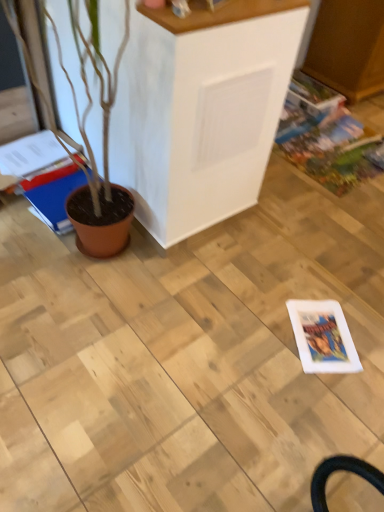
Question: From a real-world perspective, is blue glossy magazine at left, the 2th magazine from the right, physically above multicolored glossy comic book at right?

Choices:
 (A) yes
 (B) no

Answer: (A)

Question: Does blue glossy magazine at left, positioned as the first magazine in left-to-right order, lie behind multicolored glossy comic book at right?

Choices:
 (A) no
 (B) yes

Answer: (A)

Question: Is blue glossy magazine at left, positioned as the first magazine in left-to-right order, thinner than multicolored glossy comic book at right?

Choices:
 (A) yes
 (B) no

Answer: (A)

Question: Can you confirm if blue glossy magazine at left, the 2th magazine from the right, is wider than multicolored glossy comic book at right?

Choices:
 (A) yes
 (B) no

Answer: (B)

Question: Does blue glossy magazine at left, positioned as the first magazine in left-to-right order, contain multicolored glossy comic book at right?

Choices:
 (A) yes
 (B) no

Answer: (B)

Question: Does blue glossy magazine at left, positioned as the first magazine in left-to-right order, come in front of multicolored glossy comic book at right?

Choices:
 (A) yes
 (B) no

Answer: (A)

Question: Can you confirm if matte brown magazine at left, which is counted as the 1th magazine, starting from the right, is shorter than blue glossy magazine at left, the 2th magazine from the right?

Choices:
 (A) yes
 (B) no

Answer: (A)

Question: Considering the relative sizes of matte brown magazine at left, which is the 2th magazine from left to right, and blue glossy magazine at left, the 2th magazine from the right, in the image provided, is matte brown magazine at left, which is the 2th magazine from left to right, wider than blue glossy magazine at left, the 2th magazine from the right,?

Choices:
 (A) no
 (B) yes

Answer: (A)

Question: Is blue glossy magazine at left, the 2th magazine from the right, surrounded by matte brown magazine at left, which is the 2th magazine from left to right?

Choices:
 (A) no
 (B) yes

Answer: (A)

Question: Would you consider matte brown magazine at left, which is the 2th magazine from left to right, to be distant from blue glossy magazine at left, positioned as the first magazine in left-to-right order?

Choices:
 (A) no
 (B) yes

Answer: (A)

Question: Would you say matte brown magazine at left, which is the 2th magazine from left to right, is outside blue glossy magazine at left, positioned as the first magazine in left-to-right order?

Choices:
 (A) no
 (B) yes

Answer: (B)

Question: Considering the relative sizes of matte brown magazine at left, which is the 2th magazine from left to right, and blue glossy magazine at left, the 2th magazine from the right, in the image provided, is matte brown magazine at left, which is the 2th magazine from left to right, thinner than blue glossy magazine at left, the 2th magazine from the right,?

Choices:
 (A) no
 (B) yes

Answer: (B)

Question: From a real-world perspective, is blue glossy magazine at left, the 2th magazine from the right, on top of matte brown magazine at left, which is the 2th magazine from left to right?

Choices:
 (A) no
 (B) yes

Answer: (B)